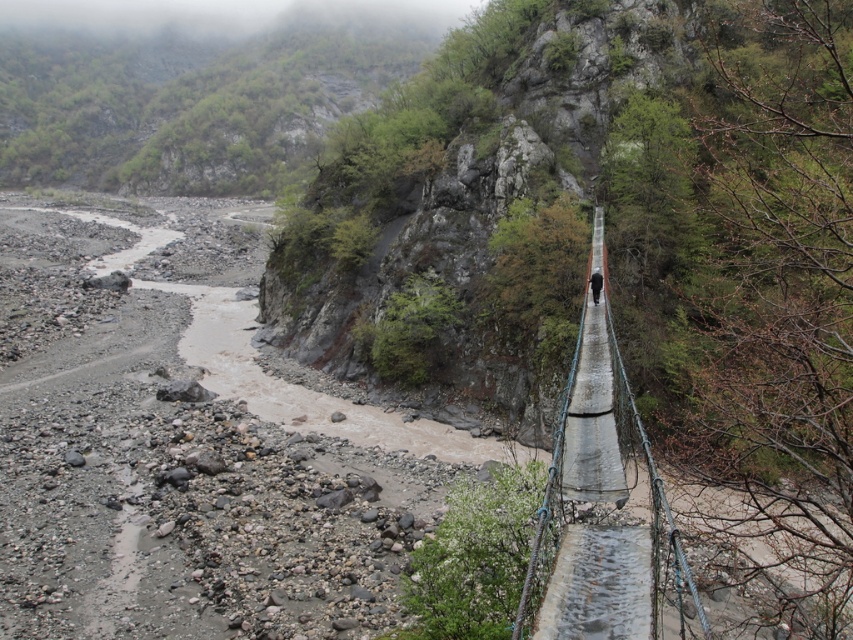
Question: Can you confirm if concrete/wooden suspension bridge at center is wider than black fabric person at center?

Choices:
 (A) yes
 (B) no

Answer: (A)

Question: Which of the following is the closest to the observer?

Choices:
 (A) black fabric person at center
 (B) concrete/wooden suspension bridge at center

Answer: (B)

Question: Where is concrete/wooden suspension bridge at center located in relation to black fabric person at center in the image?

Choices:
 (A) right
 (B) left

Answer: (B)

Question: Is concrete/wooden suspension bridge at center to the right of black fabric person at center from the viewer's perspective?

Choices:
 (A) yes
 (B) no

Answer: (B)

Question: Which object appears farthest from the camera in this image?

Choices:
 (A) black fabric person at center
 (B) concrete/wooden suspension bridge at center

Answer: (A)